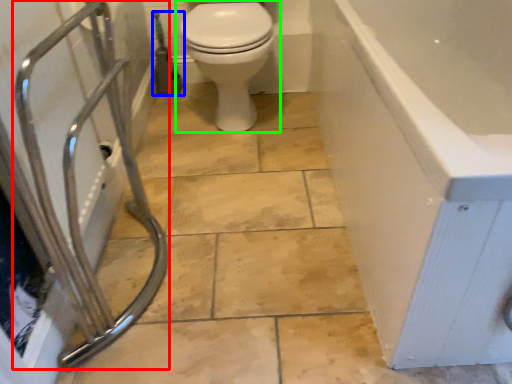
Question: Which object is the farthest from shower (highlighted by a red box)? Choose among these: garden hose (highlighted by a blue box) or toilet (highlighted by a green box).

Choices:
 (A) garden hose
 (B) toilet

Answer: (A)